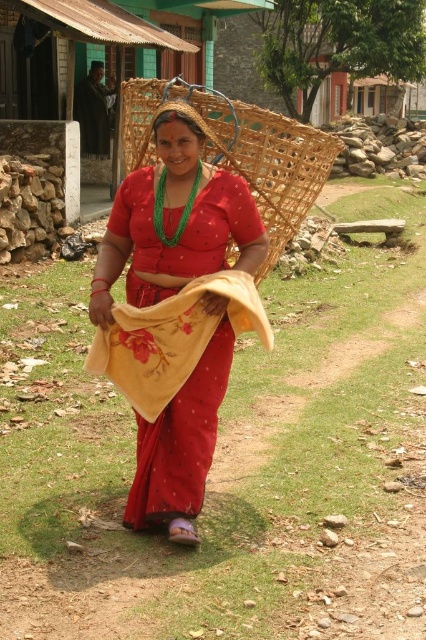
Question: Which point is farther from the camera taking this photo?

Choices:
 (A) (180, 259)
 (B) (215, 120)
 (C) (106, 352)

Answer: (B)

Question: Is matte red saree at center positioned behind woven bamboo basket at center?

Choices:
 (A) yes
 (B) no

Answer: (B)

Question: Which point is farther to the camera?

Choices:
 (A) matte red saree at center
 (B) floral yellow towel at center
 (C) woven bamboo basket at center

Answer: (C)

Question: Among these points, which one is farthest from the camera?

Choices:
 (A) (190, 362)
 (B) (284, 141)

Answer: (B)

Question: Does matte red saree at center appear on the right side of floral yellow towel at center?

Choices:
 (A) no
 (B) yes

Answer: (B)

Question: Can you confirm if matte red saree at center is positioned to the right of woven bamboo basket at center?

Choices:
 (A) no
 (B) yes

Answer: (A)